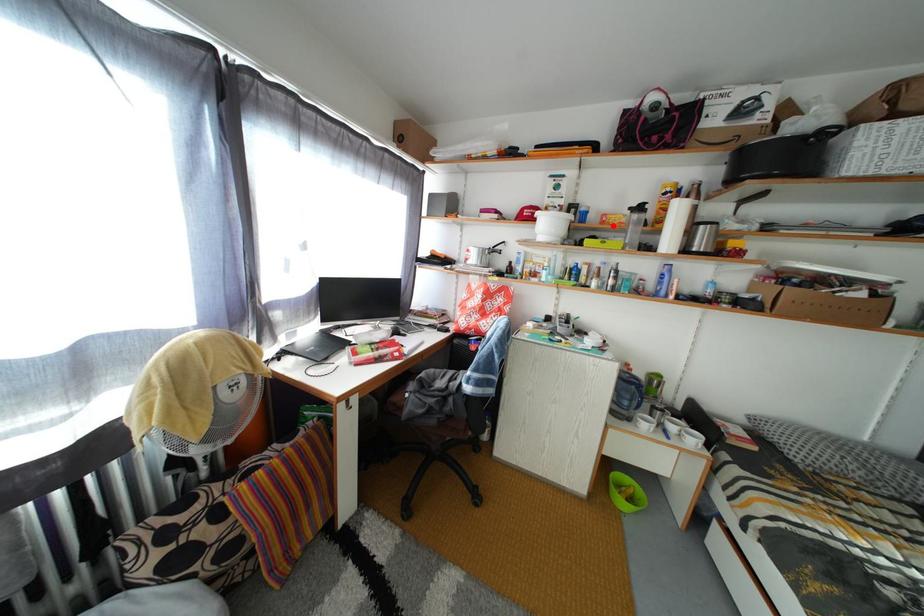
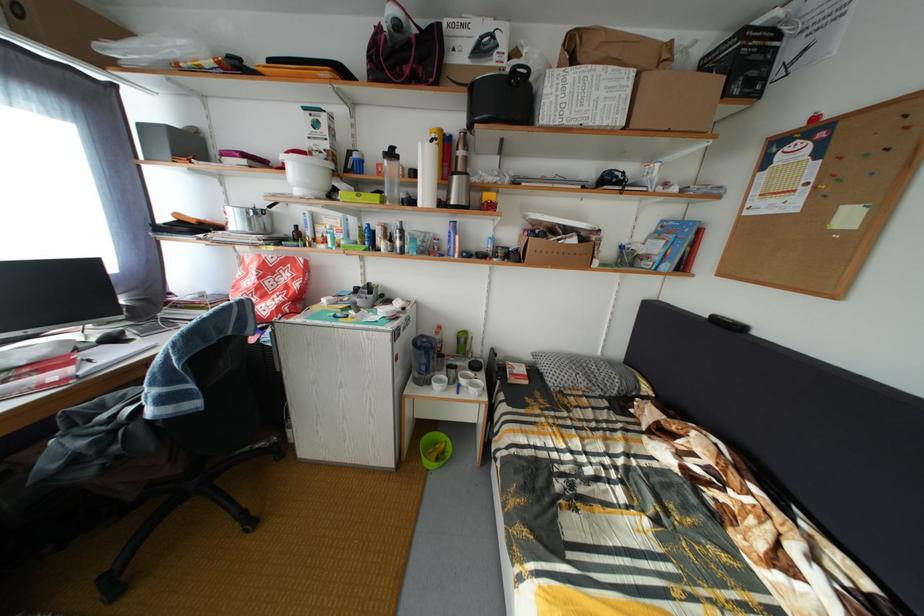
Where in the second image is the point corresponding to the highlighted location from the first image?

(388, 176)